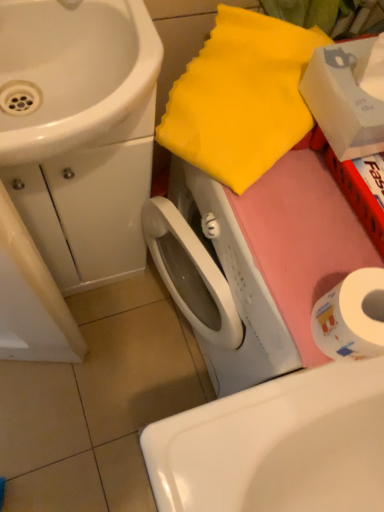
Question: Considering the positions of white paper at lower right and white cardboard box at upper right in the image, is white paper at lower right taller or shorter than white cardboard box at upper right?

Choices:
 (A) short
 (B) tall

Answer: (A)

Question: Is white paper at lower right in front of or behind white cardboard box at upper right in the image?

Choices:
 (A) front
 (B) behind

Answer: (B)

Question: Which is farther from the yellow fabric at upper right?

Choices:
 (A) white glossy sink at upper left, which is the first sink from top to bottom
 (B) white glossy sink at lower center, which is the 2th sink in left-to-right order
 (C) white cardboard box at upper right
 (D) white paper at lower right

Answer: (B)

Question: Which is nearer to the yellow fabric at upper right?

Choices:
 (A) white paper at lower right
 (B) white glossy sink at lower center, which is the 2th sink in left-to-right order
 (C) white cardboard box at upper right
 (D) white glossy sink at upper left, which ranks as the second sink in right-to-left order

Answer: (C)